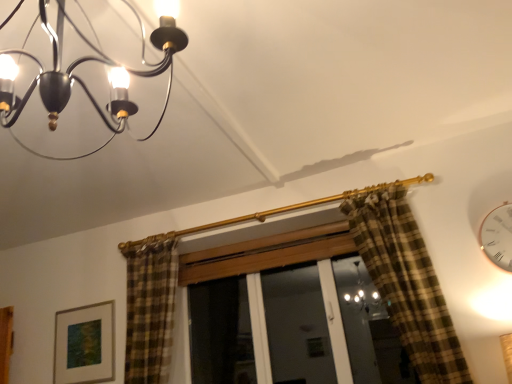
What do you see at coordinates (498, 236) in the screenshot? I see `white glossy clock at upper right` at bounding box center [498, 236].

Image resolution: width=512 pixels, height=384 pixels. Identify the location of matte gold picture frame at lower left. (84, 344).

What do you see at coordinates (85, 84) in the screenshot?
I see `matte black chandelier at upper left` at bounding box center [85, 84].

The height and width of the screenshot is (384, 512). Find the location of `white glossy clock at upper right`. white glossy clock at upper right is located at coordinates (498, 236).

From a real-world perspective, is matte black chandelier at upper left physically below matte gold picture frame at lower left?

No, from a real-world perspective, matte black chandelier at upper left is not beneath matte gold picture frame at lower left.

Is matte gold picture frame at lower left at the back of matte black chandelier at upper left?

matte black chandelier at upper left is not turned away from matte gold picture frame at lower left.

Is there a large distance between matte black chandelier at upper left and matte gold picture frame at lower left?

Indeed, matte black chandelier at upper left is not near matte gold picture frame at lower left.

How much distance is there between matte gold picture frame at lower left and white glossy clock at upper right?

The distance of matte gold picture frame at lower left from white glossy clock at upper right is 2.66 meters.

Can you confirm if matte gold picture frame at lower left is shorter than white glossy clock at upper right?

No, matte gold picture frame at lower left is not shorter than white glossy clock at upper right.

Is matte gold picture frame at lower left at the left side of white glossy clock at upper right?

Yes.

From a real-world perspective, is matte gold picture frame at lower left on white glossy clock at upper right?

No, from a real-world perspective, matte gold picture frame at lower left is not above white glossy clock at upper right.

Considering the sizes of objects white glossy clock at upper right and matte gold picture frame at lower left in the image provided, who is wider, white glossy clock at upper right or matte gold picture frame at lower left?

With larger width is white glossy clock at upper right.

Is white glossy clock at upper right positioned far away from matte gold picture frame at lower left?

Yes, white glossy clock at upper right is far from matte gold picture frame at lower left.

Is white glossy clock at upper right bigger than matte gold picture frame at lower left?

Actually, white glossy clock at upper right might be smaller than matte gold picture frame at lower left.

Between white glossy clock at upper right and matte gold picture frame at lower left, which one has less height?

With less height is white glossy clock at upper right.

In the scene shown: Is matte black chandelier at upper left in contact with white glossy clock at upper right?

No, matte black chandelier at upper left is not making contact with white glossy clock at upper right.

From a real-world perspective, is matte black chandelier at upper left positioned above or below white glossy clock at upper right?

matte black chandelier at upper left is situated higher than white glossy clock at upper right in the real world.

Measure the distance from matte black chandelier at upper left to white glossy clock at upper right.

2.01 meters.

Which of these two, white glossy clock at upper right or matte black chandelier at upper left, is wider?

matte black chandelier at upper left is wider.

From the image's perspective, which object appears higher, white glossy clock at upper right or matte black chandelier at upper left?

matte black chandelier at upper left, from the image's perspective.

What's the angular difference between white glossy clock at upper right and matte black chandelier at upper left's facing directions?

87.2 degrees separate the facing orientations of white glossy clock at upper right and matte black chandelier at upper left.

How far apart are white glossy clock at upper right and matte black chandelier at upper left?

A distance of 6.60 feet exists between white glossy clock at upper right and matte black chandelier at upper left.

Is matte gold picture frame at lower left spatially inside matte black chandelier at upper left, or outside of it?

matte gold picture frame at lower left lies outside matte black chandelier at upper left.

Locate an element on the screen. The height and width of the screenshot is (384, 512). picture frame lying behind the matte black chandelier at upper left is located at coordinates (84, 344).

Between point (90, 344) and point (40, 9), which one is positioned in front?

The point (40, 9) is in front.

How different are the orientations of matte gold picture frame at lower left and matte black chandelier at upper left in degrees?

The angular difference between matte gold picture frame at lower left and matte black chandelier at upper left is 88.7 degrees.

I want to click on picture frame located below the matte black chandelier at upper left (from the image's perspective), so click(x=84, y=344).

Find the location of a particular element. This screenshot has height=384, width=512. clock in front of the matte gold picture frame at lower left is located at coordinates (498, 236).

From the image, which object appears to be nearer to white glossy clock at upper right, matte black chandelier at upper left or matte gold picture frame at lower left?

matte black chandelier at upper left lies closer to white glossy clock at upper right than the other object.

Based on their spatial positions, is white glossy clock at upper right or matte gold picture frame at lower left further from matte black chandelier at upper left?

The object further to matte black chandelier at upper left is white glossy clock at upper right.

When comparing their distances from white glossy clock at upper right, does matte gold picture frame at lower left or matte black chandelier at upper left seem closer?

The object closer to white glossy clock at upper right is matte black chandelier at upper left.

Considering their positions, is white glossy clock at upper right positioned closer to matte gold picture frame at lower left than matte black chandelier at upper left?

Based on the image, matte black chandelier at upper left appears to be nearer to matte gold picture frame at lower left.

Consider the image. From the image, which object appears to be farther from matte gold picture frame at lower left, matte black chandelier at upper left or white glossy clock at upper right?

white glossy clock at upper right lies further to matte gold picture frame at lower left than the other object.

Which object lies further to the anchor point matte black chandelier at upper left, matte gold picture frame at lower left or white glossy clock at upper right?

white glossy clock at upper right lies further to matte black chandelier at upper left than the other object.

Image resolution: width=512 pixels, height=384 pixels. In order to click on lamp situated between matte gold picture frame at lower left and white glossy clock at upper right from left to right in this screenshot , I will do `click(85, 84)`.